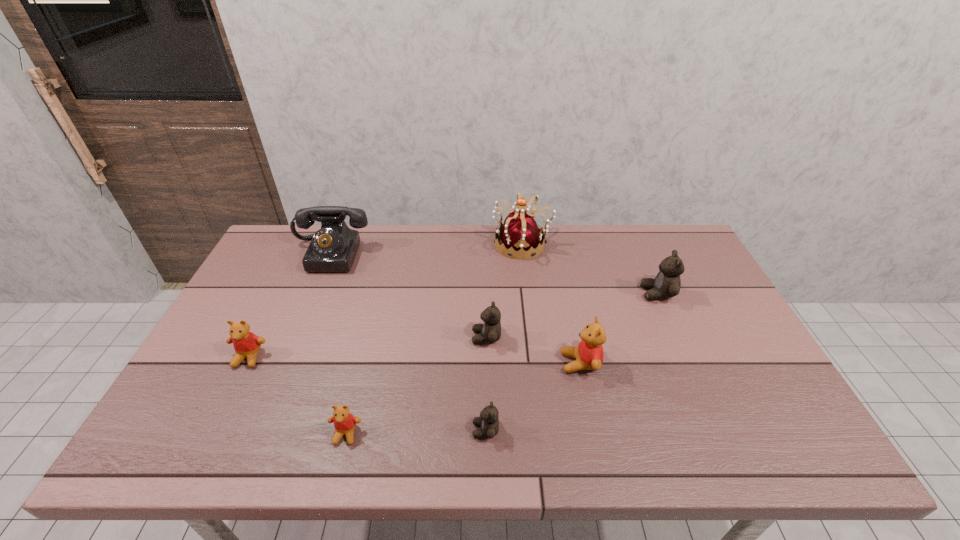
The height and width of the screenshot is (540, 960). Identify the location of free space located on the front-facing side of the rightmost red teddy bear. (430, 363).

The width and height of the screenshot is (960, 540). I want to click on vacant space situated on the front-facing side of the rightmost red teddy bear, so click(472, 363).

In order to click on blank area located 0.300m on the front-facing side of the rightmost red teddy bear in this screenshot , I will do `click(445, 363)`.

Identify the location of vacant point located 0.050m on the face of the second farthest brown teddy bear. (453, 338).

At what (x,y) coordinates should I click in order to perform the action: click on vacant space situated 0.050m on the face of the second farthest brown teddy bear. Please return your answer as a coordinate pair (x, y). The width and height of the screenshot is (960, 540). Looking at the image, I should click on (453, 338).

Identify the location of blank space located on the face of the second farthest brown teddy bear. (398, 338).

Locate an element on the screen. The image size is (960, 540). vacant space situated 0.170m on the front-facing side of the leftmost red teddy bear is located at coordinates (212, 430).

At what (x,y) coordinates should I click in order to perform the action: click on free space located on the face of the nearest brown teddy bear. Please return your answer as a coordinate pair (x, y). The height and width of the screenshot is (540, 960). Looking at the image, I should click on (313, 430).

Where is `free space located 0.360m on the face of the nearest brown teddy bear`? Image resolution: width=960 pixels, height=540 pixels. free space located 0.360m on the face of the nearest brown teddy bear is located at coordinates (313, 430).

Find the location of a particular element. The height and width of the screenshot is (540, 960). vacant space positioned 0.280m on the face of the nearest brown teddy bear is located at coordinates (348, 430).